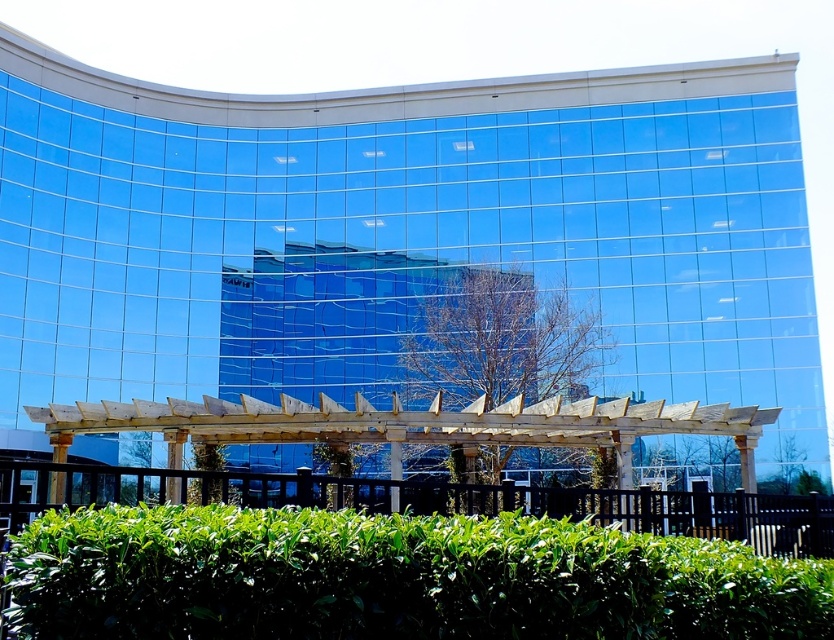
You are standing in a garden and see the green leafy hedge at lower center and the green leafy bush at center. Which one is more to the left?

The green leafy hedge at lower center is more to the left than the green leafy bush at center.